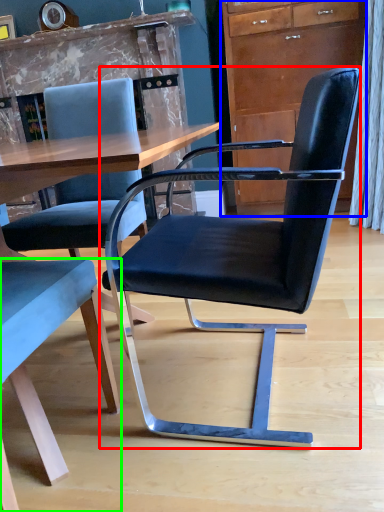
Question: Considering the real-world distances, which object is closest to chair (highlighted by a red box)? cabinetry (highlighted by a blue box) or chair (highlighted by a green box).

Choices:
 (A) cabinetry
 (B) chair

Answer: (B)